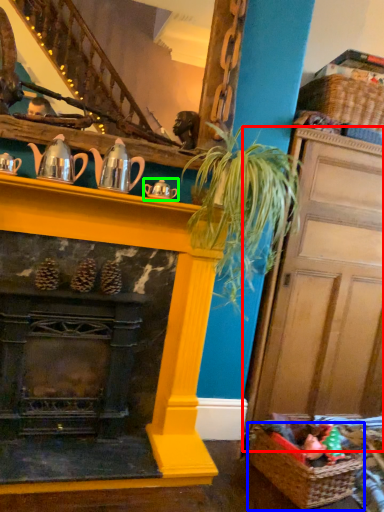
Question: Which is farther away from door (highlighted by a red box)? basket (highlighted by a blue box) or tea pot (highlighted by a green box)?

Choices:
 (A) basket
 (B) tea pot

Answer: (B)